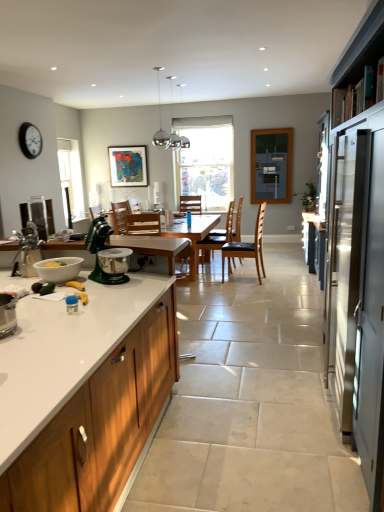
Find the location of `blank space to the left of satin silver refrigerator at right`. blank space to the left of satin silver refrigerator at right is located at coordinates (274, 416).